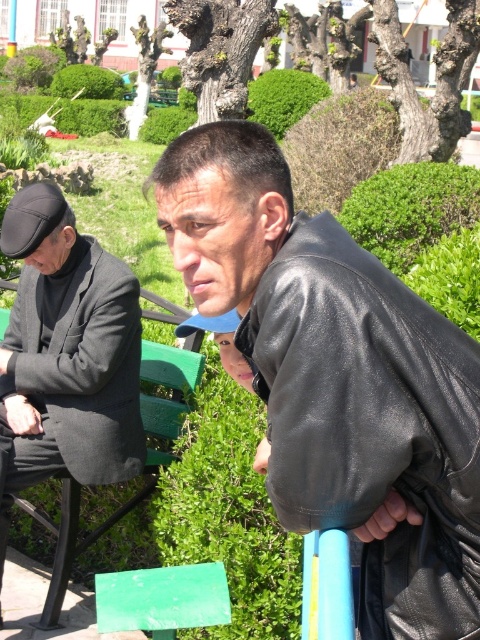
Question: Based on their relative distances, which object is nearer to the green leafy bush at center?

Choices:
 (A) dark gray woolen jacket at left
 (B) green leafy hedge at upper center
 (C) black leather jacket at upper right

Answer: (B)

Question: Is the position of black leather jacket at upper right more distant than that of green leafy hedge at upper center?

Choices:
 (A) no
 (B) yes

Answer: (A)

Question: Can you confirm if black leather jacket at upper right is bigger than green leafy bush at center?

Choices:
 (A) no
 (B) yes

Answer: (A)

Question: Can you confirm if black leather jacket at upper right is wider than dark gray woolen jacket at left?

Choices:
 (A) yes
 (B) no

Answer: (B)

Question: Estimate the real-world distances between objects in this image. Which object is farther from the green leafy bush at center?

Choices:
 (A) dark gray woolen jacket at left
 (B) black leather jacket at upper right
 (C) green leafy hedge at upper center

Answer: (B)

Question: Which object is closer to the camera taking this photo?

Choices:
 (A) green leafy hedge at upper center
 (B) black leather jacket at upper right
 (C) dark gray woolen jacket at left

Answer: (B)